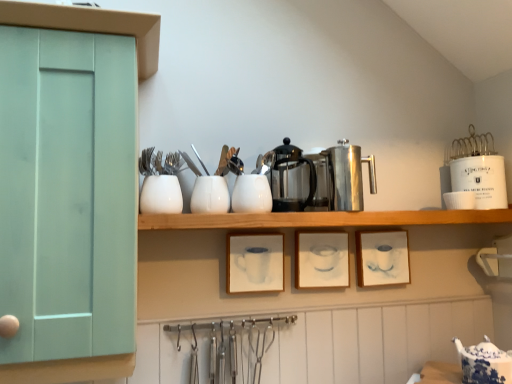
Question: Which direction should I rotate to look at matte white picture frame at center, the second picture frame viewed from the right, — up or down?

Choices:
 (A) down
 (B) up

Answer: (A)

Question: Is polished stainless steel coffee pot at center, placed as the 1th appliance when sorted from left to right, bigger than white ceramic container at upper right, acting as the first appliance starting from the right?

Choices:
 (A) no
 (B) yes

Answer: (B)

Question: Is polished stainless steel coffee pot at center, placed as the 1th appliance when sorted from left to right, positioned with its back to white ceramic container at upper right, acting as the fourth appliance starting from the left?

Choices:
 (A) yes
 (B) no

Answer: (B)

Question: Could you tell me if polished stainless steel coffee pot at center, placed as the 1th appliance when sorted from left to right, is facing white ceramic container at upper right, acting as the fourth appliance starting from the left?

Choices:
 (A) yes
 (B) no

Answer: (B)

Question: Is polished stainless steel coffee pot at center, the fourth appliance from the right, to the left of white ceramic container at upper right, acting as the fourth appliance starting from the left, from the viewer's perspective?

Choices:
 (A) yes
 (B) no

Answer: (A)

Question: From a real-world perspective, is polished stainless steel coffee pot at center, the fourth appliance from the right, on top of white ceramic container at upper right, acting as the fourth appliance starting from the left?

Choices:
 (A) no
 (B) yes

Answer: (B)

Question: From the image's perspective, is polished stainless steel coffee pot at center, the fourth appliance from the right, under white ceramic container at upper right, acting as the first appliance starting from the right?

Choices:
 (A) yes
 (B) no

Answer: (B)

Question: Could you tell me if mint green wood cabinet at left is facing white ceramic container at upper right, acting as the fourth appliance starting from the left?

Choices:
 (A) no
 (B) yes

Answer: (A)

Question: From the image's perspective, is mint green wood cabinet at left below white ceramic container at upper right, acting as the fourth appliance starting from the left?

Choices:
 (A) yes
 (B) no

Answer: (A)

Question: Is mint green wood cabinet at left not near white ceramic container at upper right, acting as the first appliance starting from the right?

Choices:
 (A) no
 (B) yes

Answer: (B)

Question: Considering the relative positions of mint green wood cabinet at left and white ceramic container at upper right, acting as the fourth appliance starting from the left, in the image provided, is mint green wood cabinet at left to the right of white ceramic container at upper right, acting as the fourth appliance starting from the left, from the viewer's perspective?

Choices:
 (A) no
 (B) yes

Answer: (A)

Question: Does mint green wood cabinet at left lie in front of white ceramic container at upper right, acting as the fourth appliance starting from the left?

Choices:
 (A) no
 (B) yes

Answer: (B)

Question: Can you confirm if mint green wood cabinet at left is shorter than white ceramic container at upper right, acting as the fourth appliance starting from the left?

Choices:
 (A) yes
 (B) no

Answer: (B)

Question: Does blue and white porcelain teapot at lower right, which is the 1th tableware in bottom-to-top order, have a larger size compared to white glossy cup at upper right, the 2th tableware viewed from the right?

Choices:
 (A) no
 (B) yes

Answer: (B)